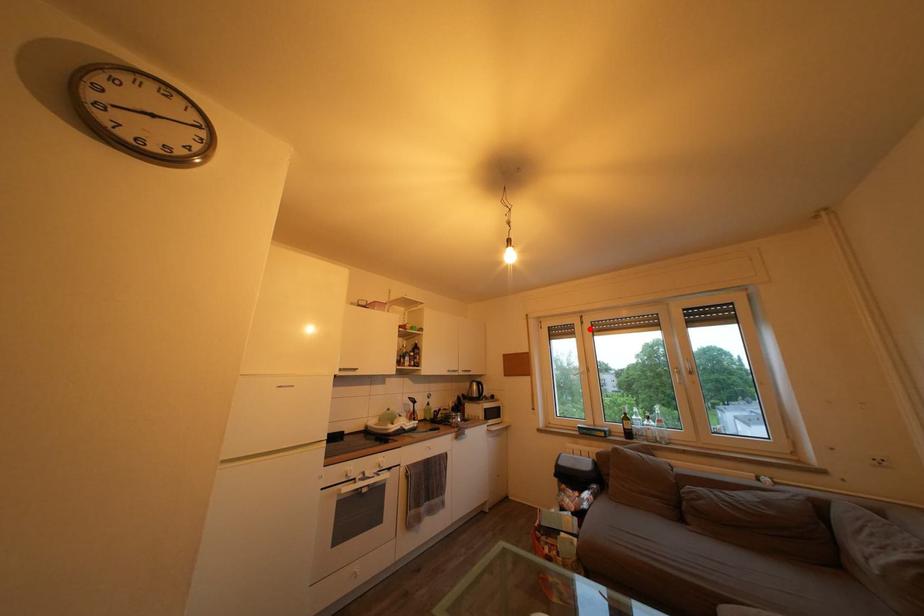
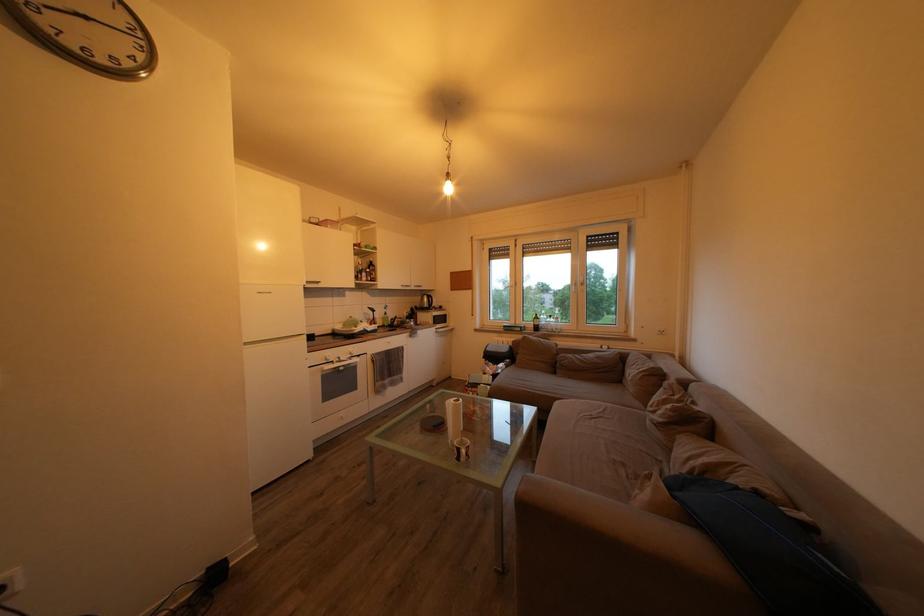
The point at the highlighted location is marked in the first image. Where is the corresponding point in the second image?

(524, 252)